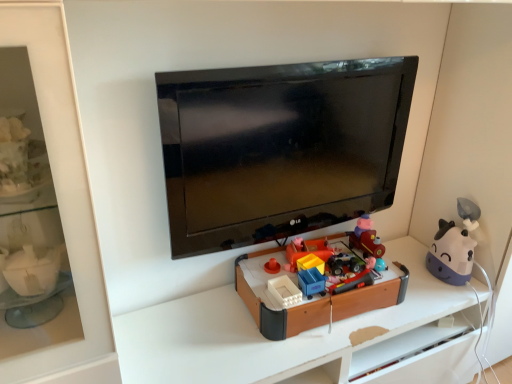
Question: From the image's perspective, is matte plastic toy train at center, which is the 2th toy in right-to-left order, under purple matte cow at right, which is the first toy in right-to-left order?

Choices:
 (A) no
 (B) yes

Answer: (A)

Question: Would you consider matte plastic toy train at center, arranged as the fifth toy when viewed from the left, to be distant from purple matte cow at right, which is the first toy in right-to-left order?

Choices:
 (A) yes
 (B) no

Answer: (B)

Question: From a real-world perspective, is matte plastic toy train at center, which is the 2th toy in right-to-left order, under purple matte cow at right, positioned as the 6th toy in left-to-right order?

Choices:
 (A) no
 (B) yes

Answer: (A)

Question: Considering the relative positions of matte plastic toy train at center, arranged as the fifth toy when viewed from the left, and purple matte cow at right, which is the first toy in right-to-left order, in the image provided, is matte plastic toy train at center, arranged as the fifth toy when viewed from the left, behind purple matte cow at right, which is the first toy in right-to-left order,?

Choices:
 (A) no
 (B) yes

Answer: (B)

Question: Can you confirm if matte plastic toy train at center, arranged as the fifth toy when viewed from the left, is positioned to the right of purple matte cow at right, which is the first toy in right-to-left order?

Choices:
 (A) yes
 (B) no

Answer: (B)

Question: From a real-world perspective, is purple matte cow at right, positioned as the 6th toy in left-to-right order, physically located above or below rubberized plastic toy car at center, the 3th toy positioned from the left?

Choices:
 (A) below
 (B) above

Answer: (A)

Question: From their relative heights in the image, would you say purple matte cow at right, which is the first toy in right-to-left order, is taller or shorter than rubberized plastic toy car at center, which ranks as the fourth toy in right-to-left order?

Choices:
 (A) tall
 (B) short

Answer: (A)

Question: Looking at their shapes, would you say purple matte cow at right, positioned as the 6th toy in left-to-right order, is wider or thinner than rubberized plastic toy car at center, the 3th toy positioned from the left?

Choices:
 (A) wide
 (B) thin

Answer: (A)

Question: Considering the positions of point (457, 258) and point (349, 283), is point (457, 258) closer or farther from the camera than point (349, 283)?

Choices:
 (A) closer
 (B) farther

Answer: (B)

Question: Based on their sizes in the image, would you say purple matte cow at right, positioned as the 6th toy in left-to-right order, is bigger or smaller than black glossy tv at center?

Choices:
 (A) small
 (B) big

Answer: (A)

Question: Considering the positions of point (457, 203) and point (259, 208), is point (457, 203) closer or farther from the camera than point (259, 208)?

Choices:
 (A) farther
 (B) closer

Answer: (A)

Question: Visually, is purple matte cow at right, positioned as the 6th toy in left-to-right order, positioned to the left or to the right of black glossy tv at center?

Choices:
 (A) left
 (B) right

Answer: (B)

Question: From their relative heights in the image, would you say purple matte cow at right, which is the first toy in right-to-left order, is taller or shorter than black glossy tv at center?

Choices:
 (A) short
 (B) tall

Answer: (A)

Question: Does point (373, 236) appear closer or farther from the camera than point (303, 243)?

Choices:
 (A) closer
 (B) farther

Answer: (B)

Question: Visually, is matte plastic toy train at center, arranged as the fifth toy when viewed from the left, positioned to the left or to the right of bright orange plastic toy at center, the 1th toy from the left?

Choices:
 (A) right
 (B) left

Answer: (A)